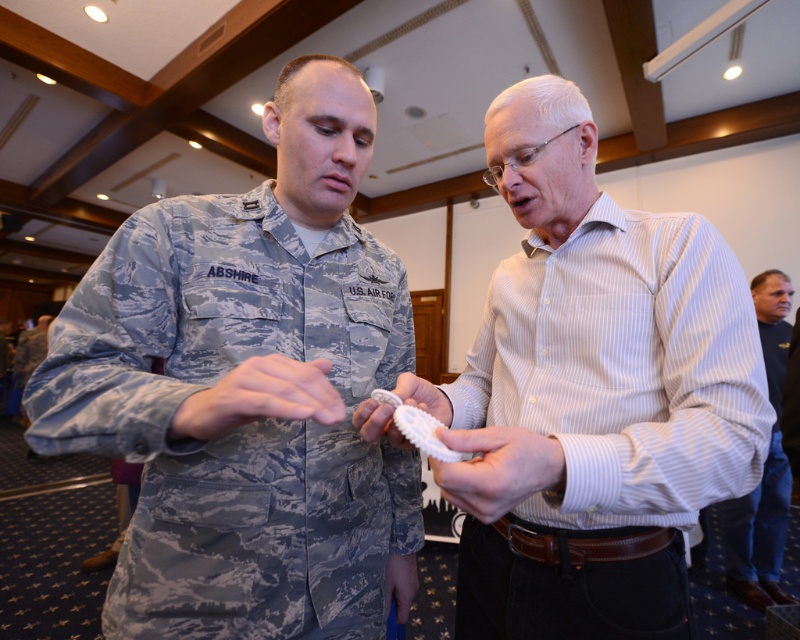
What are the coordinates of the camouflage fabric hand at center in the image?

The camouflage fabric hand at center is located at point (260, 397).

You are a robotic arm with a reach of 15 centimeters. You need to pick up the white matte gear at center from its current position. Can you reach it from where the camouflage fabric hand at center is holding? Please explain your reasoning.

The distance between the camouflage fabric hand at center and the white matte gear at center is 16.33 centimeters. Since the robotic arm can only reach 15 centimeters, it cannot reach the white matte gear at center from the camouflage fabric hand at center.